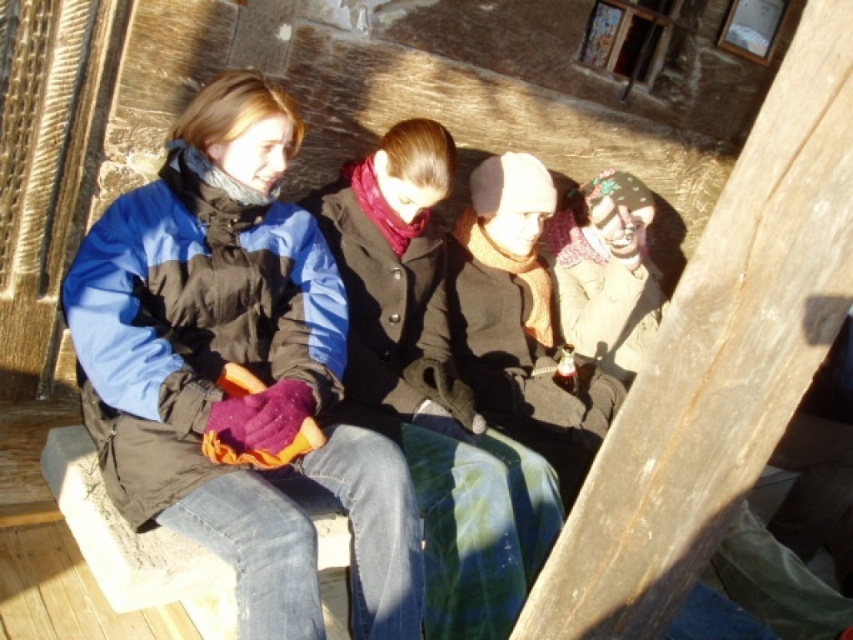
Question: Can you confirm if matte black jacket at center is positioned below velvet brown scarf at center?

Choices:
 (A) no
 (B) yes

Answer: (A)

Question: Can you confirm if matte black jacket at center is smaller than velvet brown scarf at center?

Choices:
 (A) no
 (B) yes

Answer: (A)

Question: Which of these objects is positioned farthest from the knitted wool hat at center?

Choices:
 (A) matte black jacket at center
 (B) velvet brown scarf at center

Answer: (A)

Question: Which object is closer to the camera taking this photo?

Choices:
 (A) matte black jacket at center
 (B) knitted wool hat at center

Answer: (A)

Question: Does matte black jacket at center come behind velvet brown scarf at center?

Choices:
 (A) no
 (B) yes

Answer: (A)

Question: Which object is positioned farthest from the velvet brown scarf at center?

Choices:
 (A) knitted wool hat at center
 (B) matte black jacket at center

Answer: (B)